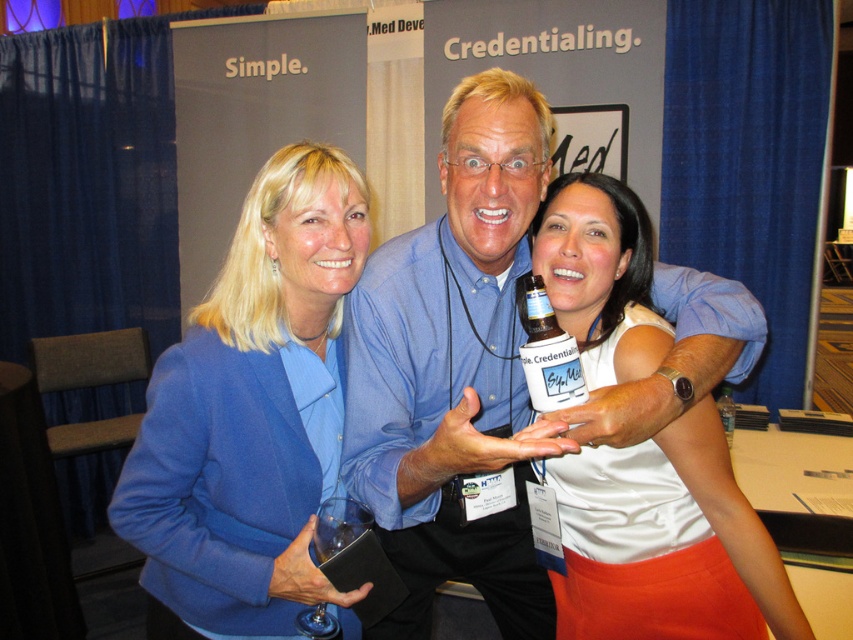
Question: Can you confirm if blue fabric jacket at center is smaller than translucent plastic bottle at center?

Choices:
 (A) yes
 (B) no

Answer: (B)

Question: Can you confirm if blue shirt at center is positioned to the right of white matte tank top at center?

Choices:
 (A) no
 (B) yes

Answer: (A)

Question: Which point appears farthest from the camera in this image?

Choices:
 (A) (724, 426)
 (B) (788, 588)

Answer: (A)

Question: Which of the following is the closest to the observer?

Choices:
 (A) (467, 579)
 (B) (724, 416)
 (C) (152, 401)
 (D) (531, 358)

Answer: (D)

Question: Does blue fabric jacket at center come in front of clear plastic bottle at center?

Choices:
 (A) yes
 (B) no

Answer: (A)

Question: Estimate the real-world distances between objects in this image. Which object is farther from the clear plastic bottle at center?

Choices:
 (A) blue fabric jacket at center
 (B) blue shirt at center
 (C) white matte tank top at center
 (D) translucent plastic bottle at center

Answer: (A)